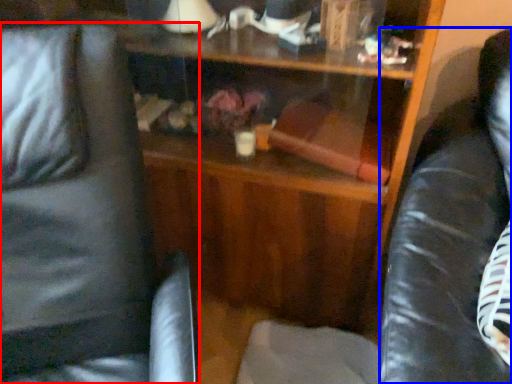
Question: Which object appears closest to the camera in this image, swivel chair (highlighted by a red box) or swivel chair (highlighted by a blue box)?

Choices:
 (A) swivel chair
 (B) swivel chair

Answer: (A)